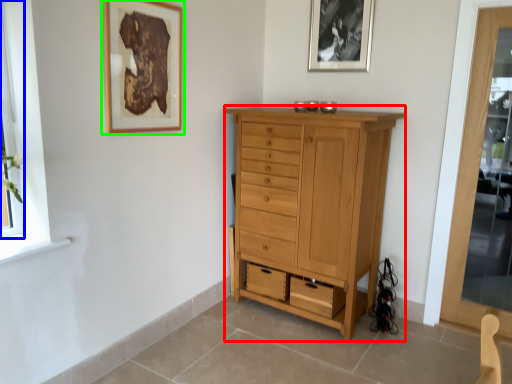
Question: Estimate the real-world distances between objects in this image. Which object is farther from chest of drawers (highlighted by a red box), window (highlighted by a blue box) or picture frame (highlighted by a green box)?

Choices:
 (A) window
 (B) picture frame

Answer: (A)